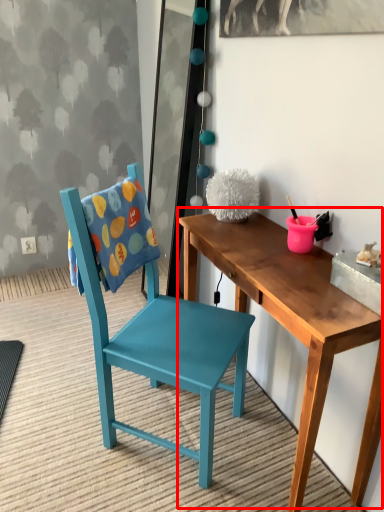
Question: From the image's perspective, where is table (annotated by the red box) located in relation to chair in the image?

Choices:
 (A) below
 (B) above

Answer: (A)